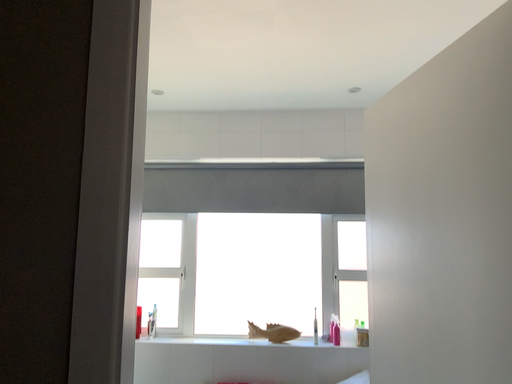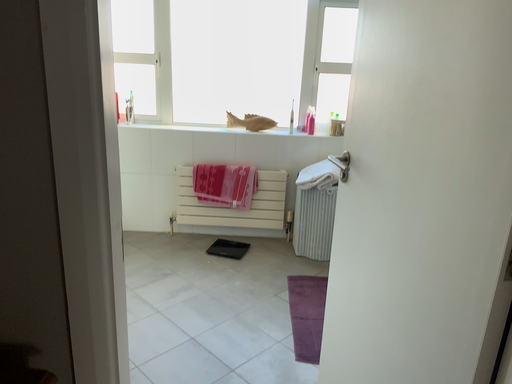
Question: Which way did the camera rotate in the video?

Choices:
 (A) rotated downward
 (B) rotated upward

Answer: (A)